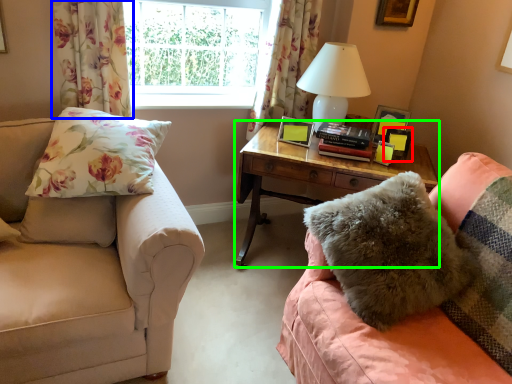
Question: Estimate the real-world distances between objects in this image. Which object is closer to picture frame (highlighted by a red box), curtain (highlighted by a blue box) or nightstand (highlighted by a green box)?

Choices:
 (A) curtain
 (B) nightstand

Answer: (B)